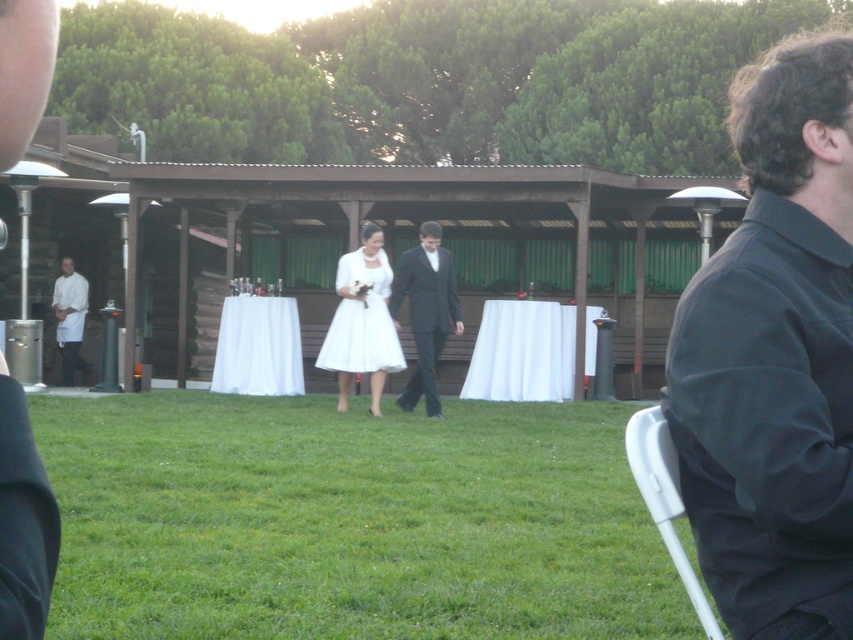
You are standing at the center of the image and want to find the white satin dress at center. According to the coordinates provided, in which direction should you look to locate it?

The white satin dress at center is located at coordinates point (363, 321), so you should look slightly to the right and down from the exact center of the image.

You are planning to place a decorative centerpiece on the white fabric tablecloth at center. According to the scene description, where exactly should you position it?

The white fabric tablecloth at center is located at point [22,522], so the decorative centerpiece should be placed at that coordinate.

In the wedding scene, there is a white fabric tablecloth at center and a black satin suit at center. Which one is positioned to the right of the other?

The white fabric tablecloth at center is to the right of the black satin suit at center.